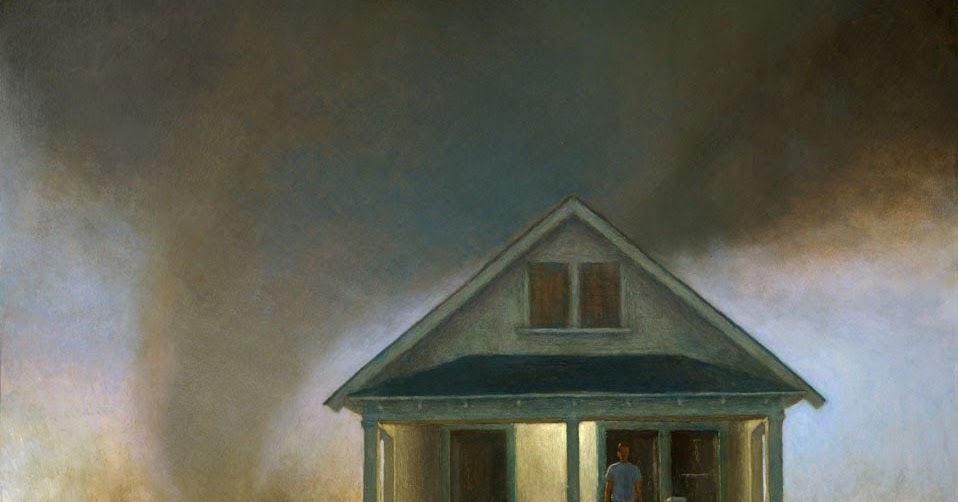
At what (x,y) coordinates should I click in order to perform the action: click on light. Please return your answer as a coordinate pair (x, y). This screenshot has width=958, height=502. Looking at the image, I should click on (563, 429).